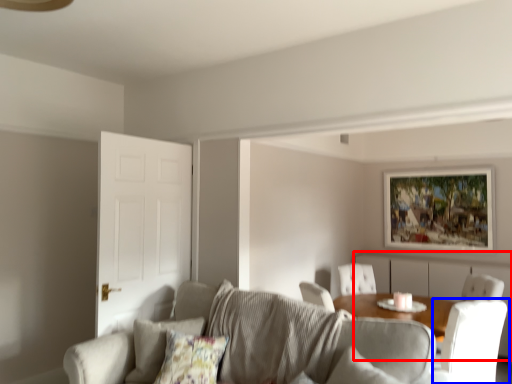
Question: Which object appears farthest to the camera in this image, dresser (highlighted by a red box) or chair (highlighted by a blue box)?

Choices:
 (A) dresser
 (B) chair

Answer: (A)